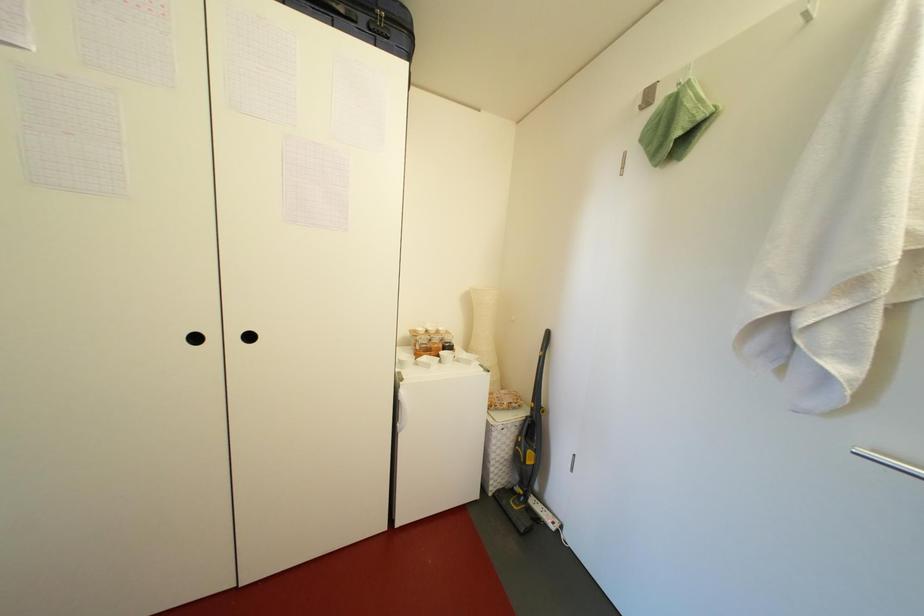
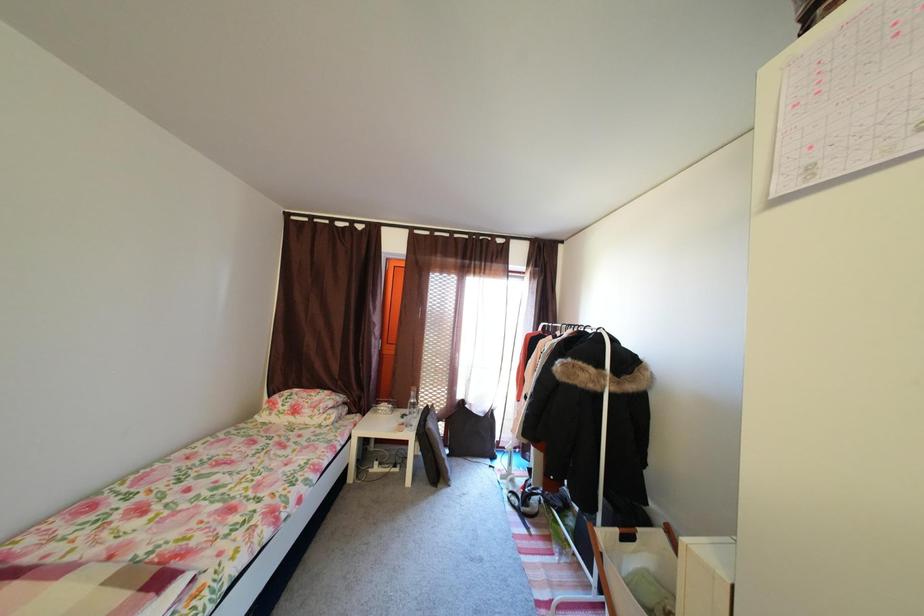
Question: Based on the continuous images, in which direction is the camera rotating? Reply with the corresponding letter.

Choices:
 (A) Left
 (B) Right
 (C) Up
 (D) Down

Answer: (A)